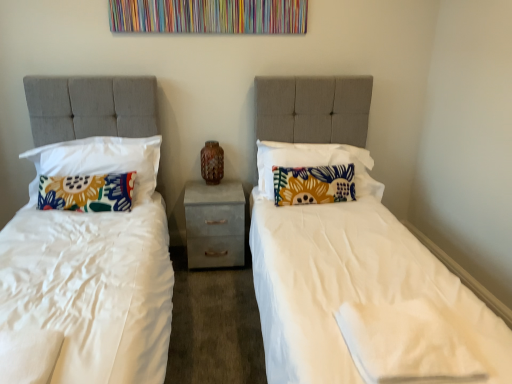
Question: Considering the relative sizes of floral fabric pillow at center, which is the third pillow in left-to-right order, and brown textured vase at center in the image provided, is floral fabric pillow at center, which is the third pillow in left-to-right order, thinner than brown textured vase at center?

Choices:
 (A) no
 (B) yes

Answer: (A)

Question: From a real-world perspective, is floral fabric pillow at center, which is the third pillow in left-to-right order, located beneath brown textured vase at center?

Choices:
 (A) no
 (B) yes

Answer: (B)

Question: Can you confirm if floral fabric pillow at center, which is the third pillow in left-to-right order, is smaller than brown textured vase at center?

Choices:
 (A) yes
 (B) no

Answer: (B)

Question: Can you confirm if floral fabric pillow at center, which is the third pillow in left-to-right order, is positioned to the right of brown textured vase at center?

Choices:
 (A) yes
 (B) no

Answer: (A)

Question: Could brown textured vase at center be considered to be inside floral fabric pillow at center, which is the second pillow in right-to-left order?

Choices:
 (A) yes
 (B) no

Answer: (B)

Question: In terms of size, does floral fabric pillow at center, which is the second pillow in right-to-left order, appear bigger or smaller than floral fabric pillow at left, arranged as the third pillow when viewed from the right?

Choices:
 (A) small
 (B) big

Answer: (A)

Question: From a real-world perspective, relative to floral fabric pillow at left, positioned as the 2th pillow in left-to-right order, is floral fabric pillow at center, which is the third pillow in left-to-right order, vertically above or below?

Choices:
 (A) below
 (B) above

Answer: (A)

Question: From the image's perspective, relative to floral fabric pillow at left, arranged as the third pillow when viewed from the right, is floral fabric pillow at center, which is the third pillow in left-to-right order, above or below?

Choices:
 (A) above
 (B) below

Answer: (B)

Question: Would you say floral fabric pillow at center, which is the second pillow in right-to-left order, is to the left or to the right of floral fabric pillow at left, arranged as the third pillow when viewed from the right, in the picture?

Choices:
 (A) right
 (B) left

Answer: (A)

Question: From a real-world perspective, is floral fabric pillow at left, marked as the first pillow in a left-to-right arrangement, physically located above or below brown textured vase at center?

Choices:
 (A) below
 (B) above

Answer: (A)

Question: Is floral fabric pillow at left, which is counted as the 4th pillow, starting from the right, taller or shorter than brown textured vase at center?

Choices:
 (A) short
 (B) tall

Answer: (B)

Question: Looking at their shapes, would you say floral fabric pillow at left, marked as the first pillow in a left-to-right arrangement, is wider or thinner than brown textured vase at center?

Choices:
 (A) thin
 (B) wide

Answer: (B)

Question: Would you say floral fabric pillow at left, marked as the first pillow in a left-to-right arrangement, is to the left or to the right of brown textured vase at center in the picture?

Choices:
 (A) right
 (B) left

Answer: (B)

Question: Looking at the image, does brown textured vase at center seem bigger or smaller compared to floral fabric pillow at center, acting as the 4th pillow starting from the left?

Choices:
 (A) big
 (B) small

Answer: (B)

Question: Looking at their shapes, would you say brown textured vase at center is wider or thinner than floral fabric pillow at center, which is the first pillow in right-to-left order?

Choices:
 (A) thin
 (B) wide

Answer: (A)